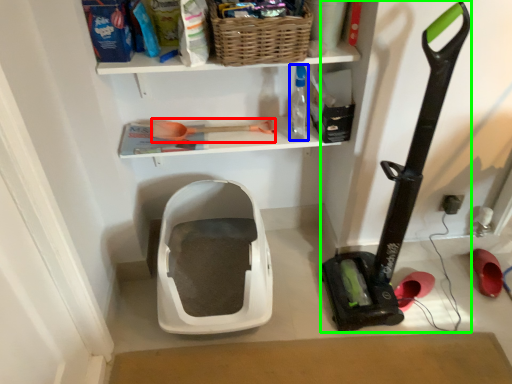
Question: Which object is positioned closest to shovel (highlighted by a red box)? Select from bottle (highlighted by a blue box) and equipment (highlighted by a green box).

Choices:
 (A) bottle
 (B) equipment

Answer: (A)